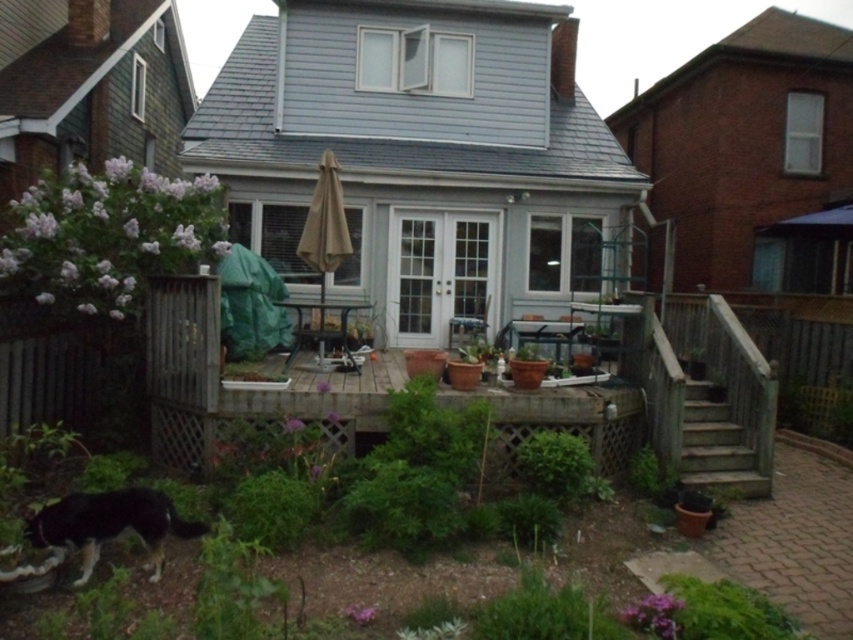
Does black fur dog at lower left appear on the right side of wooden stairs at lower right?

In fact, black fur dog at lower left is to the left of wooden stairs at lower right.

Who is taller, black fur dog at lower left or wooden stairs at lower right?

Standing taller between the two is wooden stairs at lower right.

Between point (152, 488) and point (717, 480), which one is positioned in front?

Positioned in front is point (152, 488).

Where is `black fur dog at lower left`? The image size is (853, 640). black fur dog at lower left is located at coordinates (109, 525).

Is black fur dog at lower left to the right of beige fabric umbrella at center from the viewer's perspective?

No, black fur dog at lower left is not to the right of beige fabric umbrella at center.

Which is behind, point (171, 529) or point (302, 244)?

The point (302, 244) is more distant.

Locate an element on the screen. The height and width of the screenshot is (640, 853). black fur dog at lower left is located at coordinates (109, 525).

Is wooden stairs at lower right thinner than beige fabric umbrella at center?

In fact, wooden stairs at lower right might be wider than beige fabric umbrella at center.

Does wooden stairs at lower right appear on the right side of beige fabric umbrella at center?

Correct, you'll find wooden stairs at lower right to the right of beige fabric umbrella at center.

Does point (724, 435) lie behind point (320, 285)?

No, (724, 435) is closer to viewer.

You are a GUI agent. You are given a task and a screenshot of the screen. Output one action in this format:
    pyautogui.click(x=<x>, y=<y>)
    Task: Click on the wooden stairs at lower right
    The height and width of the screenshot is (640, 853).
    Given the screenshot: What is the action you would take?
    pyautogui.click(x=721, y=445)